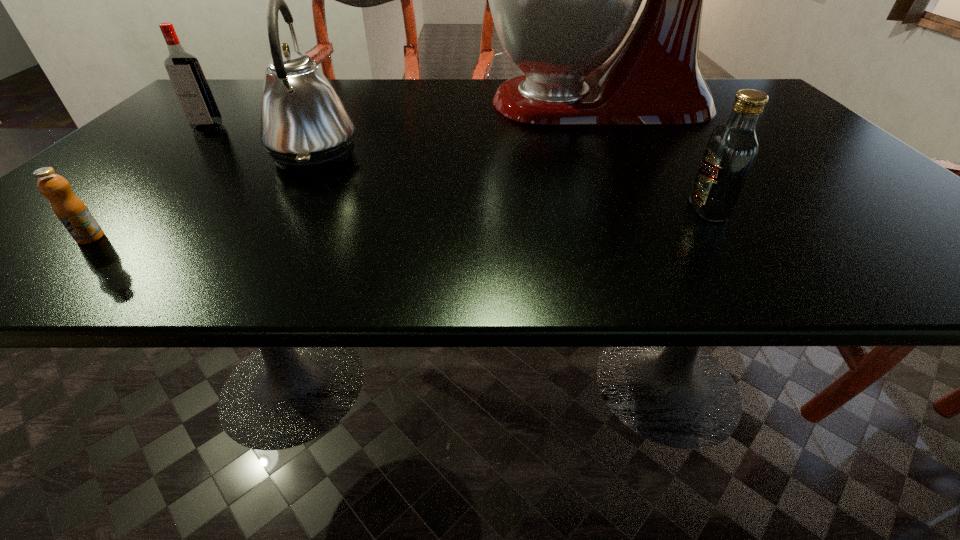
The image size is (960, 540). I want to click on empty space between the tallest object and the right vodka, so click(652, 156).

I want to click on free space between the mixer and the nearest object, so click(343, 170).

This screenshot has height=540, width=960. Find the location of `free space between the tallest object and the farther vodka`. free space between the tallest object and the farther vodka is located at coordinates pyautogui.click(x=402, y=114).

You are a GUI agent. You are given a task and a screenshot of the screen. Output one action in this format:
    pyautogui.click(x=<x>, y=<y>)
    Task: Click on the free space between the nearest object and the tallest object
    Image resolution: width=960 pixels, height=540 pixels.
    Given the screenshot: What is the action you would take?
    pyautogui.click(x=343, y=170)

Where is `empty space between the farther vodka and the mixer`? This screenshot has height=540, width=960. empty space between the farther vodka and the mixer is located at coordinates (402, 114).

At what (x,y) coordinates should I click in order to perform the action: click on vacant space in between the nearest object and the left vodka. Please return your answer as a coordinate pair (x, y). The height and width of the screenshot is (540, 960). Looking at the image, I should click on (149, 183).

You are a GUI agent. You are given a task and a screenshot of the screen. Output one action in this format:
    pyautogui.click(x=<x>, y=<y>)
    Task: Click on the free space between the nearer vodka and the fourth shortest object
    The width and height of the screenshot is (960, 540).
    Given the screenshot: What is the action you would take?
    pyautogui.click(x=512, y=182)

At what (x,y) coordinates should I click in order to perform the action: click on object identified as the fourth closest to the third object from right to left. Please return your answer as a coordinate pair (x, y). This screenshot has width=960, height=540. Looking at the image, I should click on (732, 148).

Identify which object is located as the third nearest to the right vodka. Please provide its 2D coordinates. Your answer should be formatted as a tuple, i.e. [(x, y)], where the tuple contains the x and y coordinates of a point satisfying the conditions above.

[(72, 212)]

Locate an element on the screen. free space that satisfies the following two spatial constraints: 1. at the attachment hub of the mixer; 2. on the front side of the kettle is located at coordinates (623, 155).